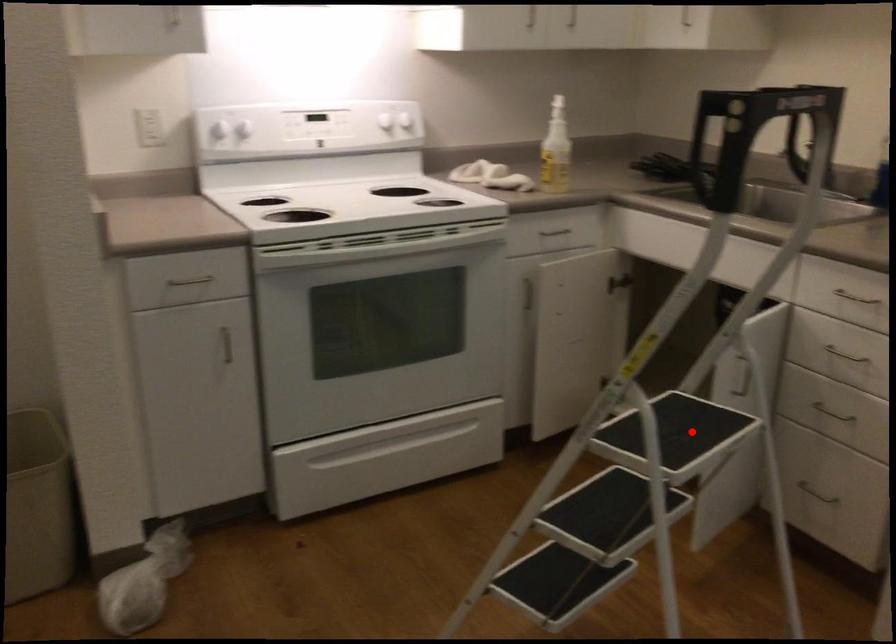
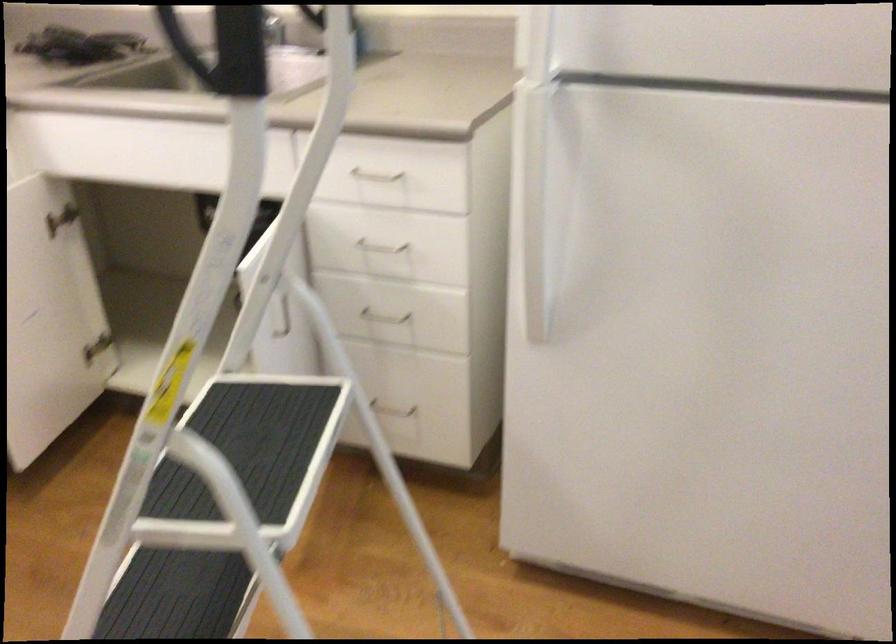
Locate, in the second image, the point that corresponds to the highlighted location in the first image.

(247, 448)